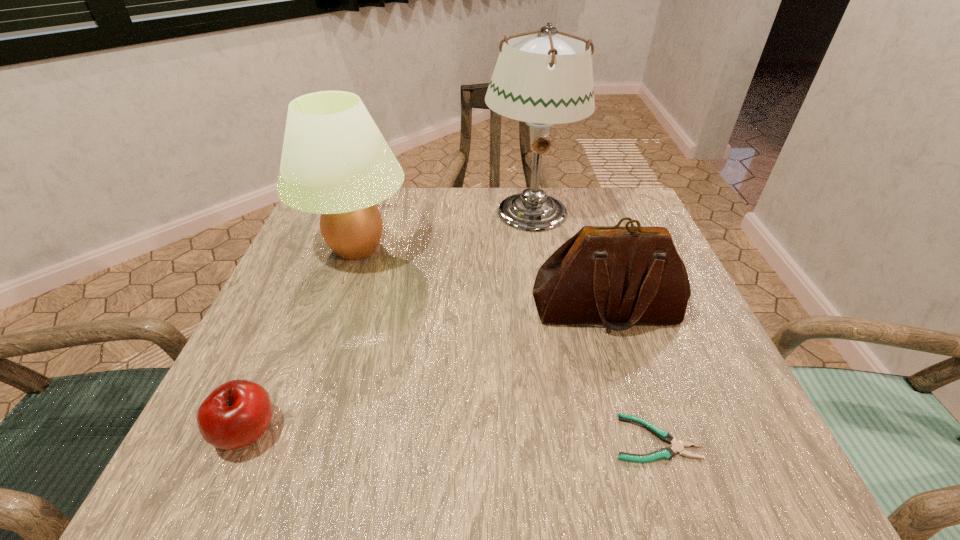
This screenshot has height=540, width=960. I want to click on object that is at the near right corner, so click(667, 453).

Image resolution: width=960 pixels, height=540 pixels. In the image, there is a desktop. Identify the location of free region at the far edge. (459, 188).

This screenshot has height=540, width=960. What are the coordinates of `vacant space at the near edge` in the screenshot? It's located at (389, 448).

The image size is (960, 540). Find the location of `free space at the left edge`. free space at the left edge is located at coordinates (304, 277).

Identify the location of free spot at the right edge of the desktop. The image size is (960, 540). (636, 364).

Locate an element on the screen. vacant space at the near right corner of the desktop is located at coordinates (x=712, y=432).

The height and width of the screenshot is (540, 960). What are the coordinates of `empty location between the shortest object and the tallest object` in the screenshot? It's located at (592, 325).

Identify the location of free space between the taller lampshade and the left lampshade. (444, 230).

The width and height of the screenshot is (960, 540). In order to click on free spot between the shortest object and the apple in this screenshot , I will do `click(451, 435)`.

The image size is (960, 540). I want to click on unoccupied position between the fourth tallest object and the shoulder bag, so click(x=426, y=370).